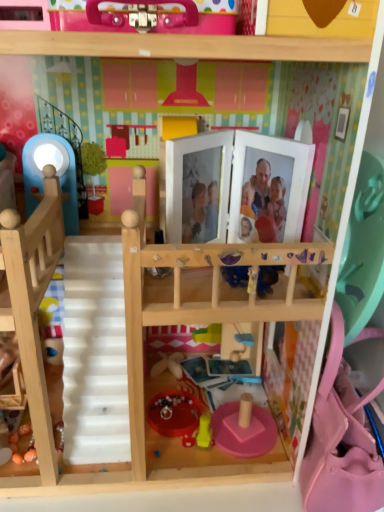
The image size is (384, 512). Identify the location of vacant region to the left of pink fabric purse at right. (218, 464).